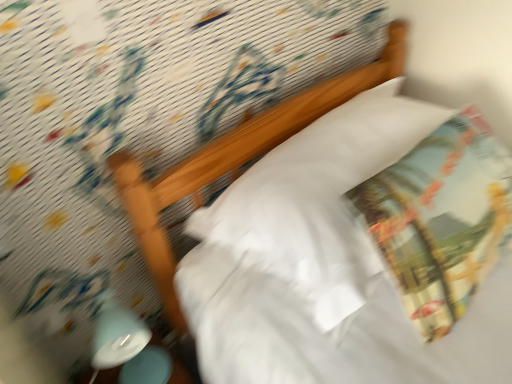
Question: From a real-world perspective, is white glossy bedside lamp at lower left beneath printed fabric throw pillow at upper right?

Choices:
 (A) no
 (B) yes

Answer: (B)

Question: Is printed fabric throw pillow at upper right at the back of white glossy bedside lamp at lower left?

Choices:
 (A) no
 (B) yes

Answer: (A)

Question: Does white glossy bedside lamp at lower left have a lesser height compared to printed fabric throw pillow at upper right?

Choices:
 (A) yes
 (B) no

Answer: (B)

Question: Considering the relative sizes of white glossy bedside lamp at lower left and printed fabric throw pillow at upper right in the image provided, is white glossy bedside lamp at lower left wider than printed fabric throw pillow at upper right?

Choices:
 (A) no
 (B) yes

Answer: (A)

Question: Can you confirm if white glossy bedside lamp at lower left is bigger than printed fabric throw pillow at upper right?

Choices:
 (A) no
 (B) yes

Answer: (A)

Question: From the image's perspective, is white glossy bedside lamp at lower left located above printed fabric throw pillow at upper right?

Choices:
 (A) no
 (B) yes

Answer: (A)

Question: Can you confirm if printed fabric throw pillow at upper right is taller than white glossy bedside lamp at lower left?

Choices:
 (A) no
 (B) yes

Answer: (A)

Question: Can you confirm if printed fabric throw pillow at upper right is positioned to the left of white glossy bedside lamp at lower left?

Choices:
 (A) yes
 (B) no

Answer: (B)

Question: Can you confirm if printed fabric throw pillow at upper right is smaller than white glossy bedside lamp at lower left?

Choices:
 (A) yes
 (B) no

Answer: (B)

Question: Is white glossy bedside lamp at lower left located within printed fabric throw pillow at upper right?

Choices:
 (A) no
 (B) yes

Answer: (A)

Question: Is printed fabric throw pillow at upper right turned away from white glossy bedside lamp at lower left?

Choices:
 (A) yes
 (B) no

Answer: (B)

Question: Does printed fabric throw pillow at upper right lie behind white glossy bedside lamp at lower left?

Choices:
 (A) no
 (B) yes

Answer: (A)

Question: Does white soft pillow at center have a greater width compared to printed fabric throw pillow at upper right?

Choices:
 (A) no
 (B) yes

Answer: (B)